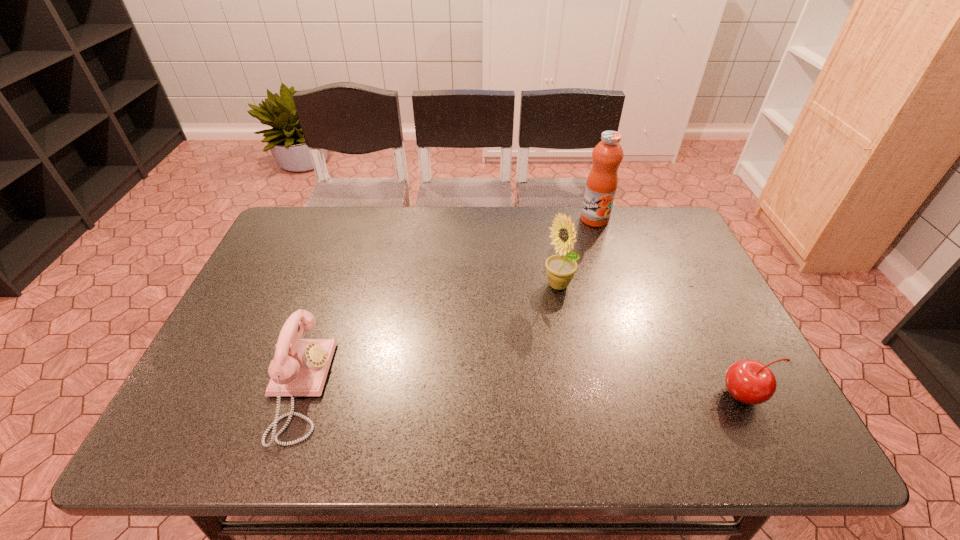
Find the location of a particular element. vacant area that lies between the third tallest object and the fruit juice is located at coordinates (446, 303).

Locate an element on the screen. free space that is in between the third nearest object and the shortest object is located at coordinates (652, 341).

This screenshot has height=540, width=960. What are the coordinates of `free space between the third nearest object and the rightmost object` in the screenshot? It's located at (652, 341).

Identify the location of free space that is in between the leftmost object and the shortest object. (521, 392).

Identify the location of free space between the farthest object and the third shortest object. (577, 253).

Where is `vacant area that lies between the shortest object and the fruit juice`? vacant area that lies between the shortest object and the fruit juice is located at coordinates (669, 307).

This screenshot has width=960, height=540. I want to click on object that is the second closest one to the tallest object, so click(x=750, y=382).

Identify the location of the second closest object to the second object from right to left. The height and width of the screenshot is (540, 960). (750, 382).

Where is `free location that satisfies the following two spatial constraints: 1. on the front side of the shortest object; 2. on the right side of the third shortest object`? This screenshot has width=960, height=540. free location that satisfies the following two spatial constraints: 1. on the front side of the shortest object; 2. on the right side of the third shortest object is located at coordinates (579, 395).

At what (x,y) coordinates should I click in order to perform the action: click on vacant space that satisfies the following two spatial constraints: 1. on the front side of the third object from left to right; 2. on the right side of the cherry. Please return your answer as a coordinate pair (x, y). Looking at the image, I should click on (652, 395).